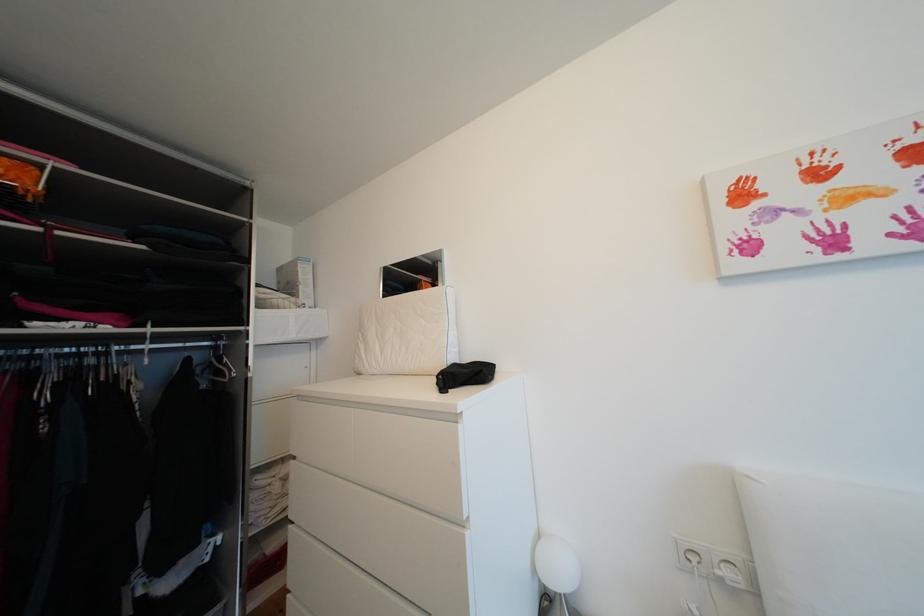
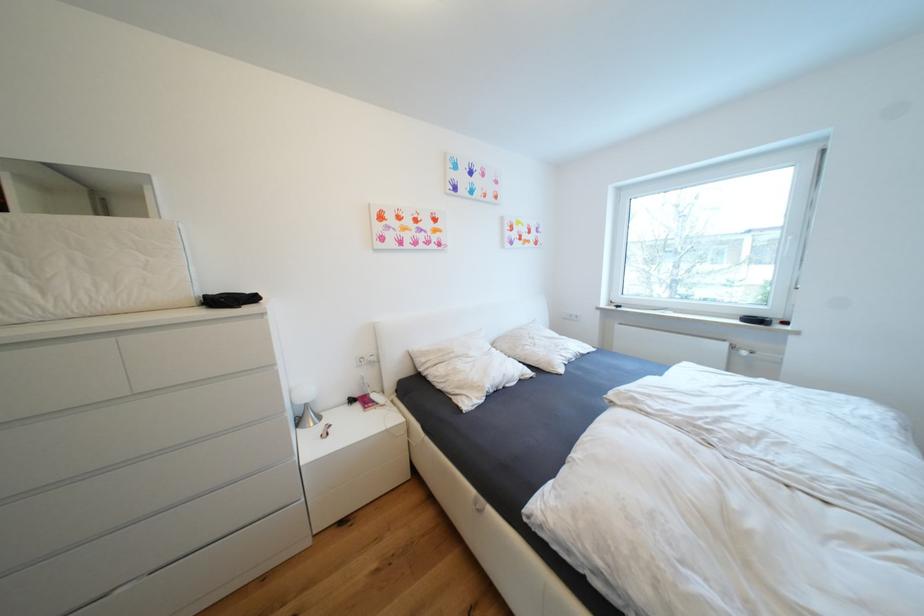
In the second image, find the point that corresponds to pixel 473 362 in the first image.

(222, 294)